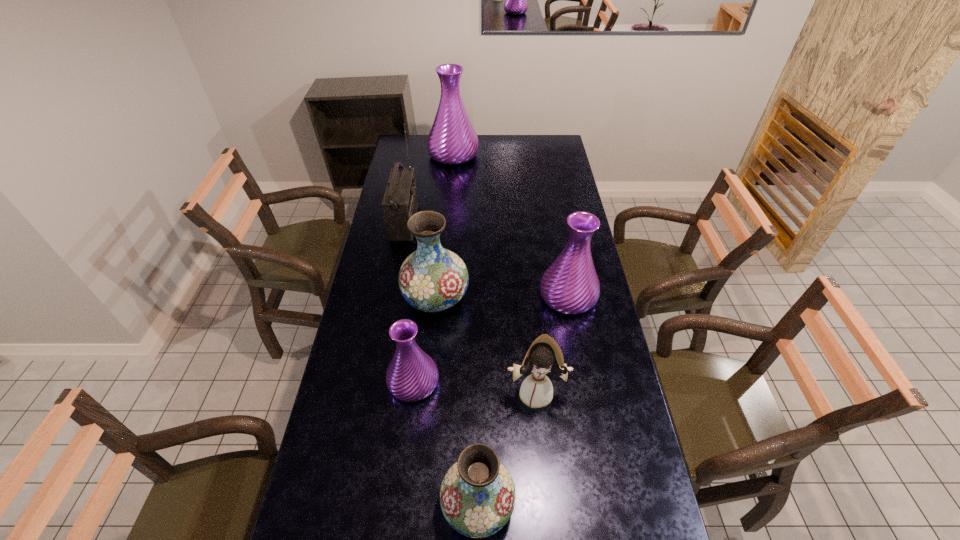
Locate an element on the screen. The height and width of the screenshot is (540, 960). the tallest vase is located at coordinates (452, 140).

This screenshot has height=540, width=960. Identify the location of the farthest object. (452, 140).

Where is `radio receiver`? The height and width of the screenshot is (540, 960). radio receiver is located at coordinates (400, 202).

Locate an element on the screen. The height and width of the screenshot is (540, 960). the second farthest object is located at coordinates (400, 202).

The image size is (960, 540). I want to click on the rightmost purple vase, so click(570, 285).

Where is `the second biggest purple vase`? The height and width of the screenshot is (540, 960). the second biggest purple vase is located at coordinates (570, 285).

Where is `the farther blue vase`? the farther blue vase is located at coordinates tap(431, 279).

The image size is (960, 540). What are the coordinates of `doll` in the screenshot? It's located at click(x=545, y=355).

Locate an element on the screen. Image resolution: width=960 pixels, height=540 pixels. the nearest purple vase is located at coordinates (412, 375).

Image resolution: width=960 pixels, height=540 pixels. What are the coordinates of `the smallest purple vase` in the screenshot? It's located at (412, 375).